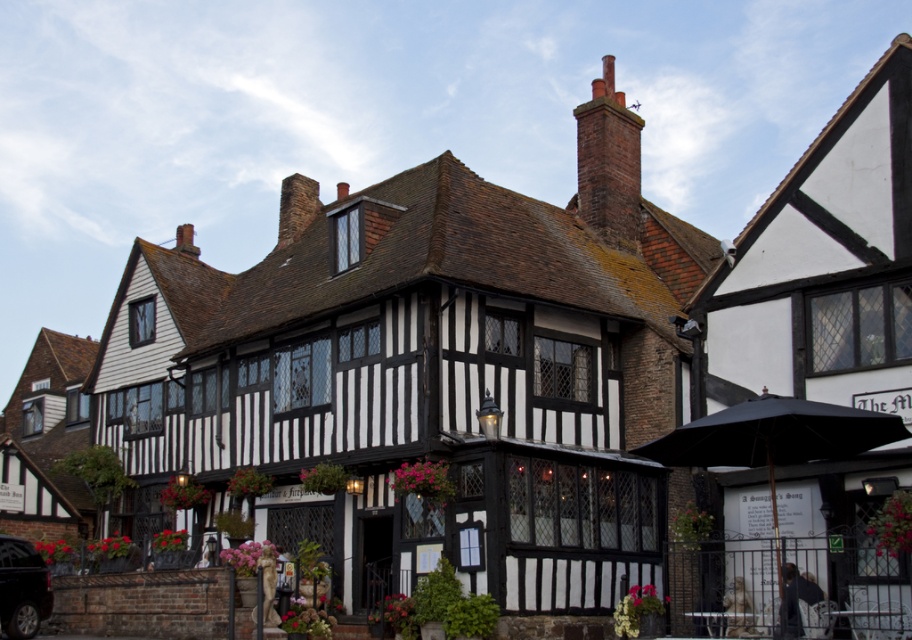
Question: Which of the following is the farthest from the observer?

Choices:
 (A) coord(584,147)
 (B) coord(24,589)

Answer: (A)

Question: Which of the following is the farthest from the observer?

Choices:
 (A) red brick chimney at upper center
 (B) shiny black car at lower left

Answer: (A)

Question: Can you confirm if red brick chimney at upper center is wider than shiny black car at lower left?

Choices:
 (A) yes
 (B) no

Answer: (A)

Question: Can you confirm if red brick chimney at upper center is positioned below shiny black car at lower left?

Choices:
 (A) no
 (B) yes

Answer: (A)

Question: Which point is farther from the camera taking this photo?

Choices:
 (A) (636, 212)
 (B) (9, 609)

Answer: (A)

Question: Can you confirm if red brick chimney at upper center is positioned below shiny black car at lower left?

Choices:
 (A) no
 (B) yes

Answer: (A)